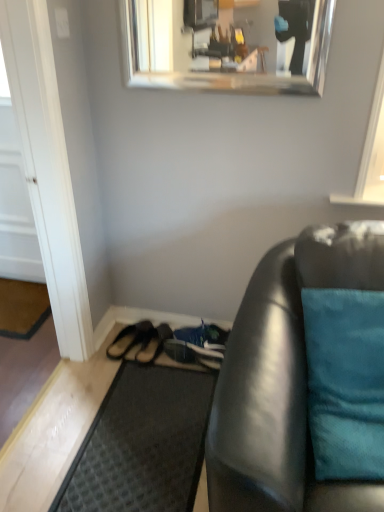
Question: Does black rubber doormat at lower center, which is the 1th doormat from front to back, have a larger size compared to teal fabric pillow at right?

Choices:
 (A) no
 (B) yes

Answer: (A)

Question: Would you say teal fabric pillow at right is part of black rubber doormat at lower center, the 2th doormat when ordered from left to right,'s contents?

Choices:
 (A) no
 (B) yes

Answer: (A)

Question: From a real-world perspective, is black rubber doormat at lower center, which is the 1th doormat from front to back, on top of teal fabric pillow at right?

Choices:
 (A) yes
 (B) no

Answer: (B)

Question: Can you confirm if black rubber doormat at lower center, which is the second doormat from top to bottom, is positioned to the left of teal fabric pillow at right?

Choices:
 (A) no
 (B) yes

Answer: (B)

Question: Does black rubber doormat at lower center, which ranks as the 2th doormat in back-to-front order, have a greater width compared to teal fabric pillow at right?

Choices:
 (A) yes
 (B) no

Answer: (A)

Question: Is black rubber doormat at lower center, which is the 1th doormat from front to back, smaller than teal fabric pillow at right?

Choices:
 (A) yes
 (B) no

Answer: (A)

Question: Can you confirm if silver metallic mirror at upper center is positioned to the right of dark gray textured mat at left, the first doormat viewed from the back?

Choices:
 (A) yes
 (B) no

Answer: (A)

Question: Does silver metallic mirror at upper center have a larger size compared to dark gray textured mat at left, the first doormat viewed from the back?

Choices:
 (A) no
 (B) yes

Answer: (B)

Question: Is dark gray textured mat at left, the 1th doormat in the left-to-right sequence, completely or partially inside silver metallic mirror at upper center?

Choices:
 (A) no
 (B) yes

Answer: (A)

Question: Does silver metallic mirror at upper center come in front of dark gray textured mat at left, the 1th doormat positioned from the top?

Choices:
 (A) no
 (B) yes

Answer: (B)

Question: From the image's perspective, is silver metallic mirror at upper center on dark gray textured mat at left, the 1th doormat in the left-to-right sequence?

Choices:
 (A) no
 (B) yes

Answer: (B)

Question: Does silver metallic mirror at upper center have a lesser width compared to dark gray textured mat at left, which is the 2th doormat from front to back?

Choices:
 (A) no
 (B) yes

Answer: (B)

Question: Is white glossy door at left wider than black rubber doormat at lower center, marked as the 1th doormat in a right-to-left arrangement?

Choices:
 (A) yes
 (B) no

Answer: (B)